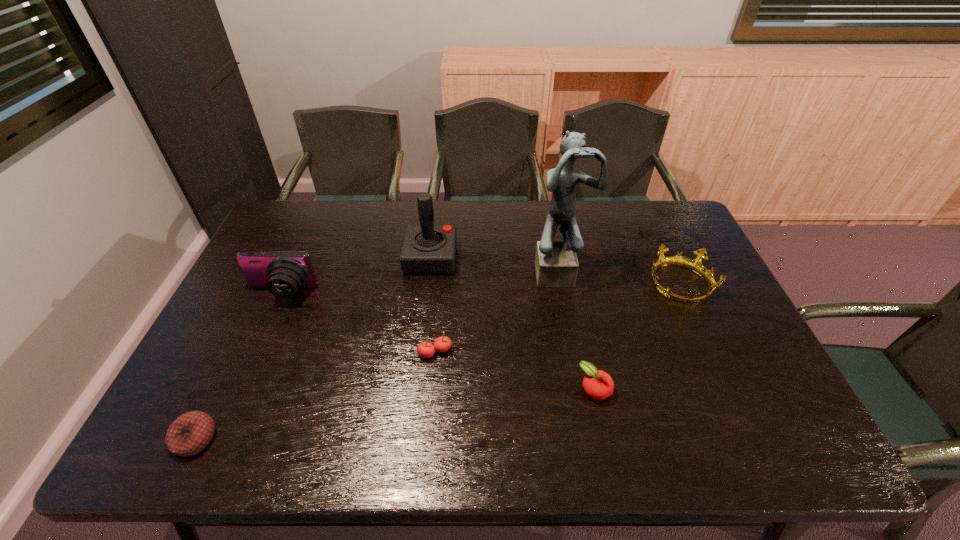
Identify the location of vacant space that satisfies the following two spatial constraints: 1. on the base of the sixth shortest object; 2. on the front-facing side of the camera. (426, 294).

Find the location of a particular element. free point that satisfies the following two spatial constraints: 1. on the face of the tallest object; 2. on the right side of the second nearest object is located at coordinates (581, 389).

At what (x,y) coordinates should I click in order to perform the action: click on vacant position in the image that satisfies the following two spatial constraints: 1. on the front-facing side of the camera; 2. on the left side of the apple. Please return your answer as a coordinate pair (x, y). Looking at the image, I should click on (238, 389).

Identify the location of free space that satisfies the following two spatial constraints: 1. on the base of the cherry; 2. on the right side of the second tallest object. (419, 352).

This screenshot has width=960, height=540. In order to click on vacant space that satisfies the following two spatial constraints: 1. on the back side of the rightmost object; 2. on the right side of the third nearest object in this screenshot , I will do `click(441, 285)`.

At what (x,y) coordinates should I click in order to perform the action: click on free space that satisfies the following two spatial constraints: 1. on the back side of the apple; 2. on the left side of the nearest object. Please return your answer as a coordinate pair (x, y). The height and width of the screenshot is (540, 960). Looking at the image, I should click on (219, 389).

Identify the location of vacant space that satisfies the following two spatial constraints: 1. on the base of the second tallest object; 2. on the back side of the second nearest object. This screenshot has width=960, height=540. (415, 389).